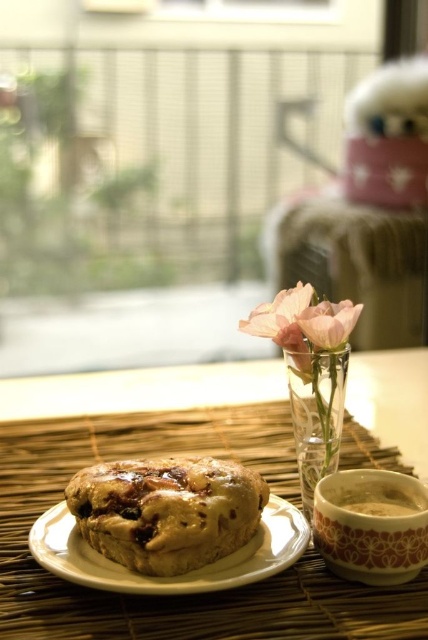
You are sitting at a table with the white ceramic plate at center and the pink glass vase at center in front of you. Which object is closer to you?

The white ceramic plate at center is closer to you than the pink glass vase at center.

You are setting up a small table for a tea party. The white ceramic plate at center holds a scone, and the pink glass vase at center has flowers. If the table is only 10 inches wide, will the plate and vase fit side by side without overlapping?

The white ceramic plate at center and pink glass vase at center are 8.56 inches apart, so they can fit side by side on a 10 inch wide table since 8.56 inches is less than 10 inches.